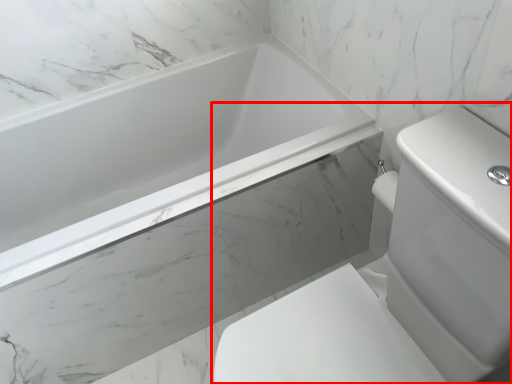
Question: From the image's perspective, where is sink (annotated by the red box) located relative to bathtub?

Choices:
 (A) below
 (B) above

Answer: (A)